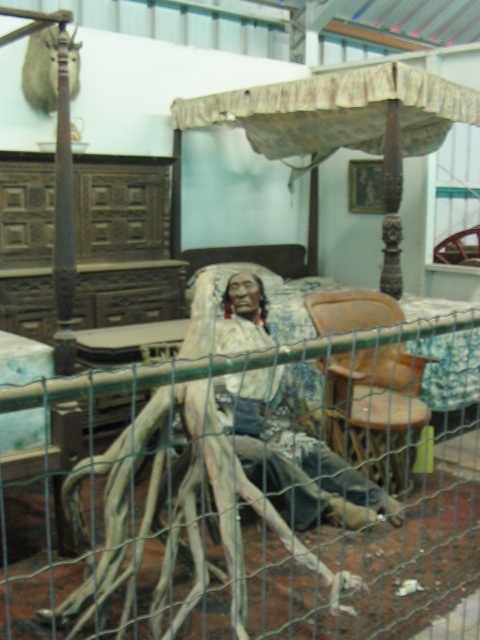
Question: Which point is farther to the camera?

Choices:
 (A) (356, 147)
 (B) (400, 404)

Answer: (A)

Question: Which object appears farthest from the camera in this image?

Choices:
 (A) brown leather chair at center
 (B) green wire mesh at center

Answer: (A)

Question: Does wooden canopy bed at center appear on the right side of brown leather chair at center?

Choices:
 (A) no
 (B) yes

Answer: (A)

Question: Can you confirm if green wire mesh at center is positioned to the left of wooden canopy bed at center?

Choices:
 (A) no
 (B) yes

Answer: (B)

Question: Does matte brown wooden mannequin at center have a larger size compared to brown leather chair at center?

Choices:
 (A) yes
 (B) no

Answer: (A)

Question: Which of the following is the farthest from the observer?

Choices:
 (A) (210, 440)
 (B) (222, 106)
 (C) (240, 394)

Answer: (B)